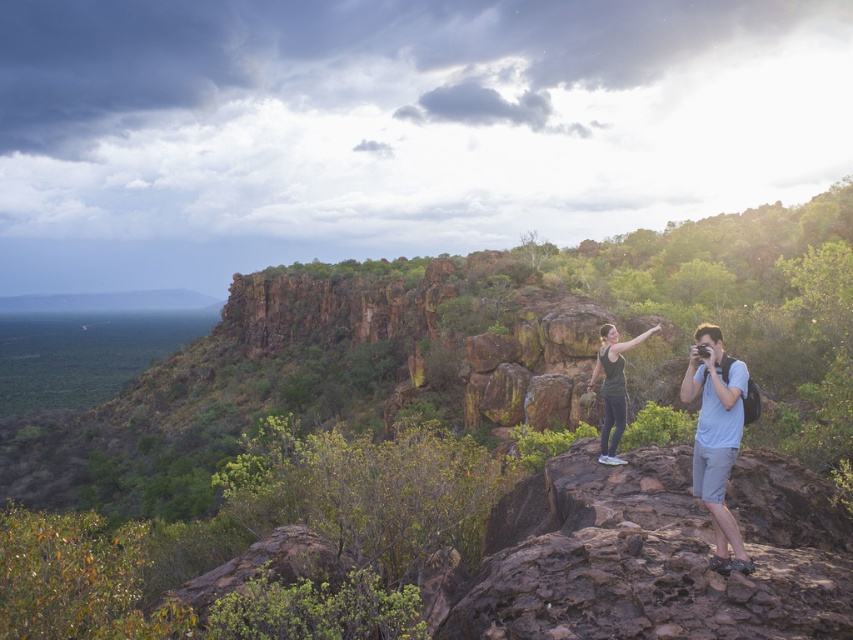
You are a photographer standing at the edge of the rocky outcrop in the scene. You notice two points marked in the image. Which point, point (494, 260) or point (693, 380), is closer to your camera lens?

Point (494, 260) is further to the camera than point (693, 380), so the point closer to the camera lens is point (494, 260).

You are a photographer positioned at the lower left corner of the image. You want to take a photo that includes both the point at coordinates point (714, 342) and point (619, 404). Since you can only focus on one point at a time, which point should you focus on to ensure the other point remains in the background?

You should focus on point (714, 342) because it is in front of point (619, 404), so the latter will naturally be in the background.

You are standing at the center of the image and want to take a photo of the rustic rock formation at center. Which direction should you move to get closer to it?

You should move towards the center of the image to get closer to the rustic rock formation at center since it is located at point (419, 470).